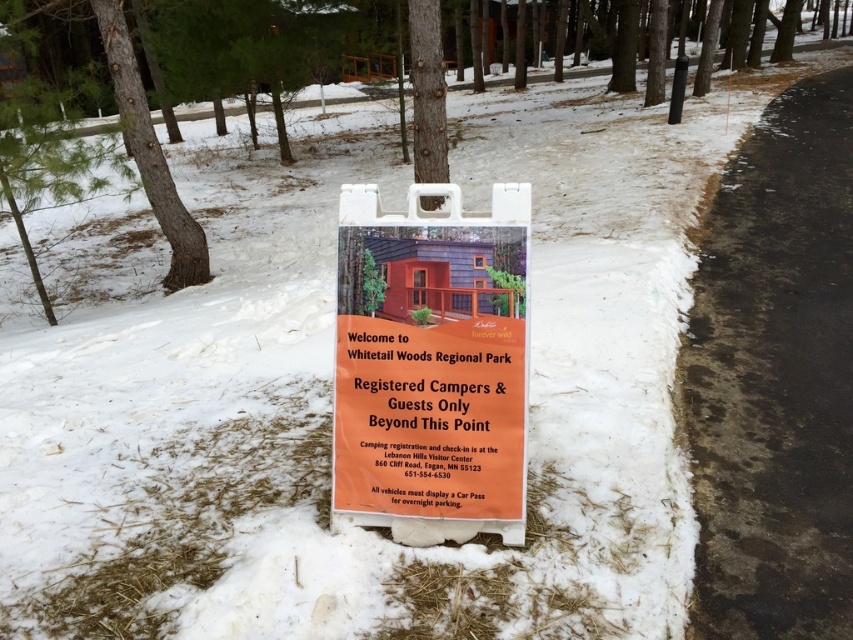
Does orange paper sign at center lie behind smooth brown bark at left?

No, orange paper sign at center is closer to the viewer.

Between orange paper sign at center and smooth brown bark at left, which one appears on the left side from the viewer's perspective?

From the viewer's perspective, smooth brown bark at left appears more on the left side.

At what (x,y) coordinates should I click in order to perform the action: click on orange paper sign at center. Please return your answer as a coordinate pair (x, y). Image resolution: width=853 pixels, height=640 pixels. Looking at the image, I should click on coord(431,365).

Where is `orange paper sign at center`? The width and height of the screenshot is (853, 640). orange paper sign at center is located at coordinates (431, 365).

Locate an element on the screen. orange paper sign at center is located at coordinates (431, 365).

Is orange paper sign at center bigger than smooth brown tree trunk at center?

No, orange paper sign at center is not bigger than smooth brown tree trunk at center.

Which is behind, point (505, 275) or point (437, 200)?

The point (437, 200) is more distant.

You are a GUI agent. You are given a task and a screenshot of the screen. Output one action in this format:
    pyautogui.click(x=<x>, y=<y>)
    Task: Click on the orange paper sign at center
    The width and height of the screenshot is (853, 640).
    Given the screenshot: What is the action you would take?
    pyautogui.click(x=431, y=365)

Which is below, smooth brown bark at left or smooth brown tree trunk at center?

smooth brown bark at left is below.

Consider the image. Which is above, smooth brown bark at left or smooth brown tree trunk at center?

smooth brown tree trunk at center is higher up.

Between point (173, 252) and point (433, 138), which one is positioned in front?

Positioned in front is point (433, 138).

Where is `smooth brown bark at left`? This screenshot has width=853, height=640. smooth brown bark at left is located at coordinates (149, 152).